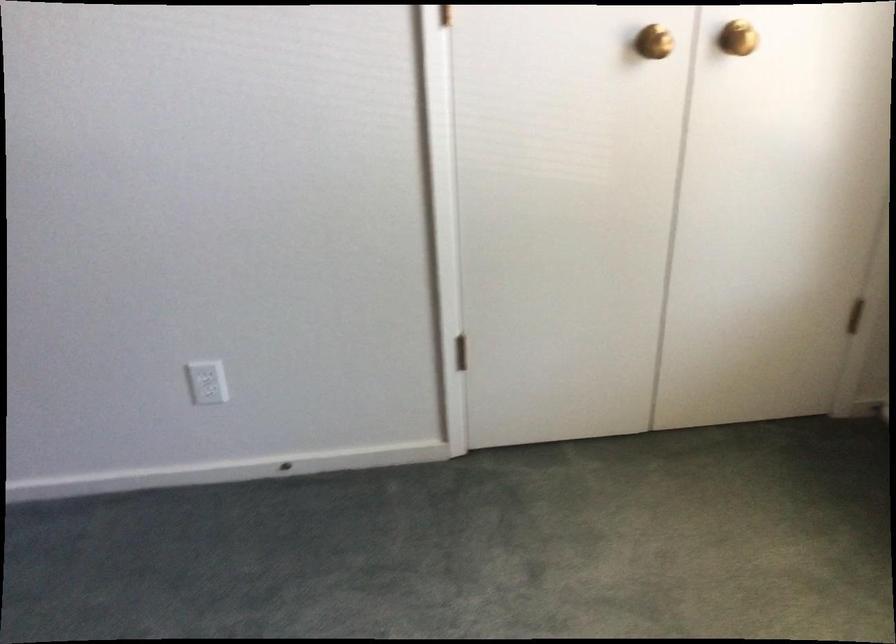
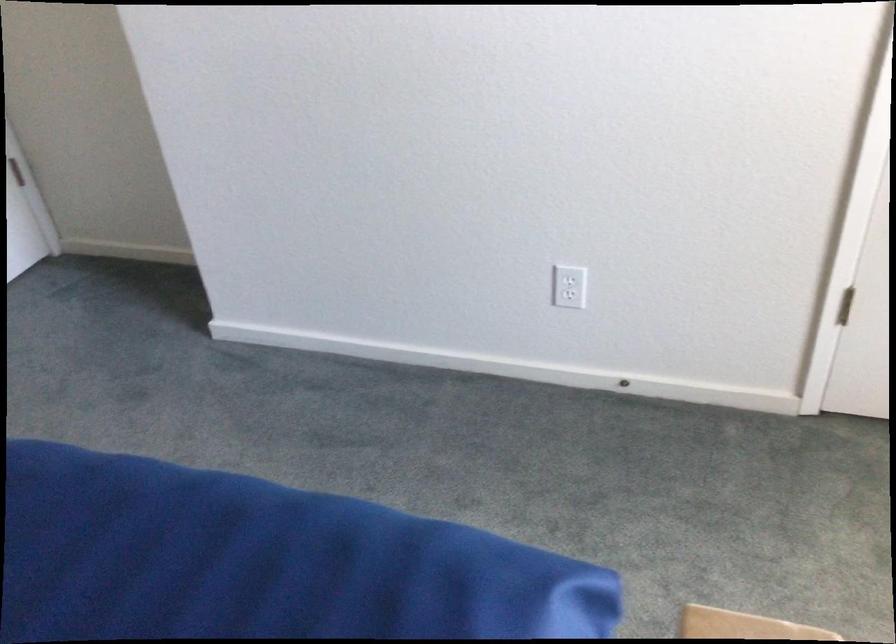
Where in the second image is the point corresponding to point 286,466 from the first image?

(624, 384)